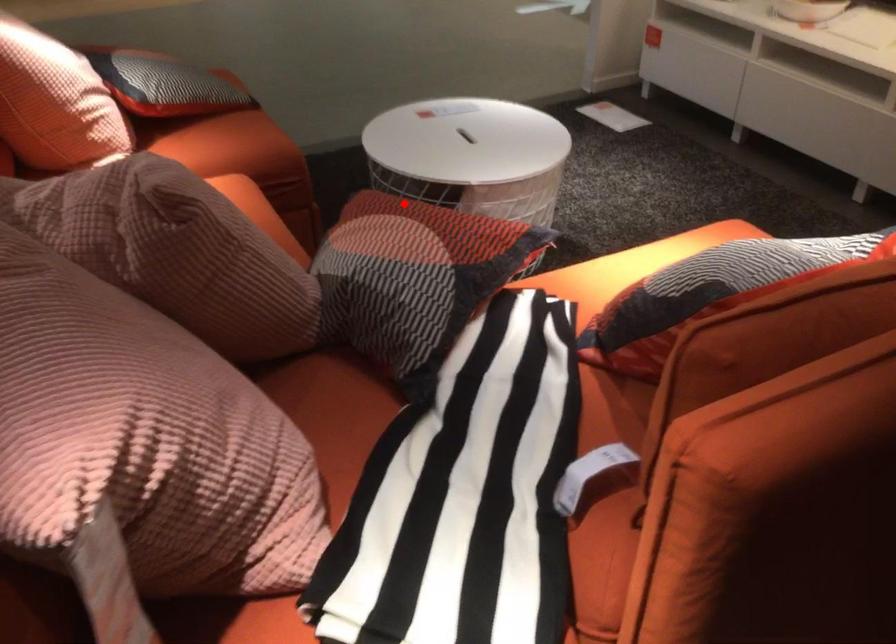
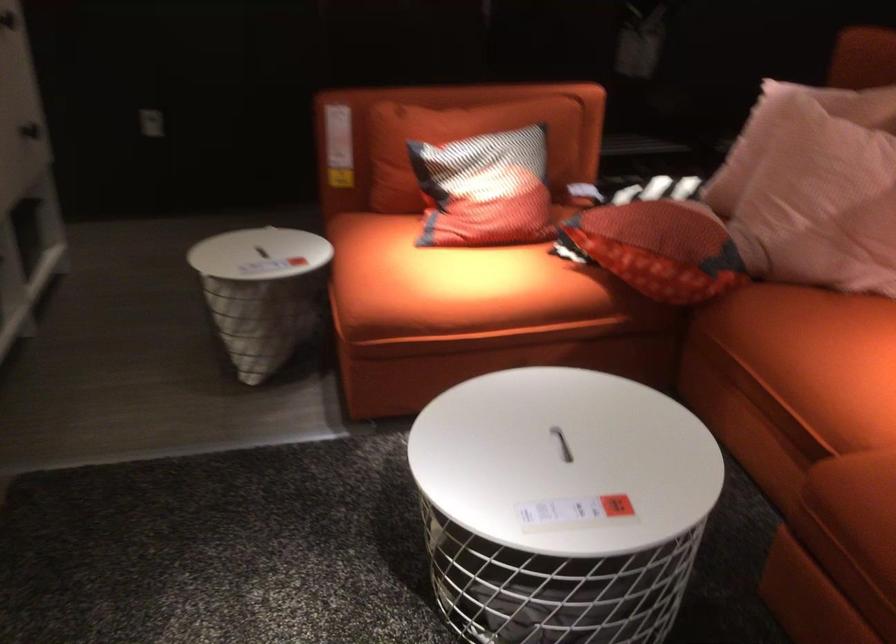
Question: I am providing you with two images of the same scene from different viewpoints. Image1 has a red point marked. In image2, the corresponding 3D location appears at what relative position? Reply with the corresponding letter.

Choices:
 (A) Closer
 (B) Farther

Answer: (B)